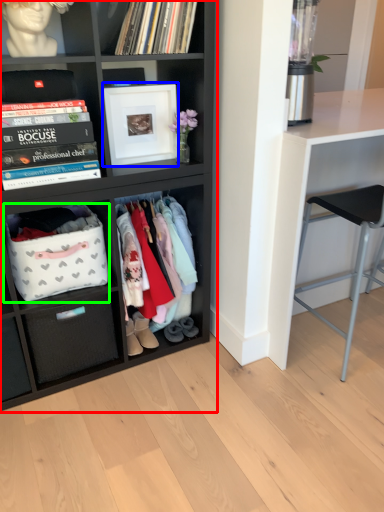
Question: Considering the real-world distances, which object is farthest from shelf (highlighted by a red box)? picture frame (highlighted by a blue box) or storage box (highlighted by a green box)?

Choices:
 (A) picture frame
 (B) storage box

Answer: (A)